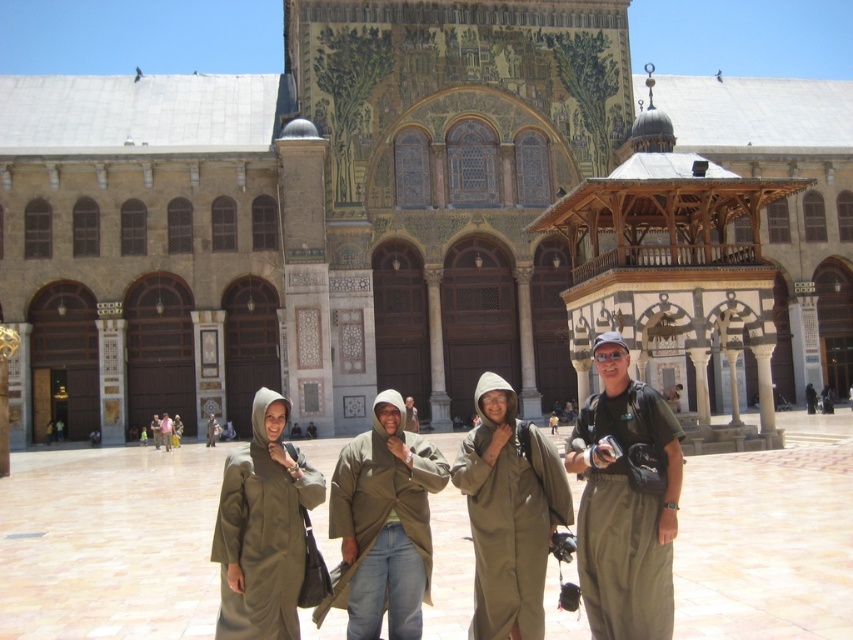
Question: Can you confirm if matte olive green jacket at center is positioned to the right of green fabric jacket at center?

Choices:
 (A) no
 (B) yes

Answer: (B)

Question: Which point is closer to the camera?

Choices:
 (A) (598, 477)
 (B) (387, 541)
 (C) (210, 445)
 (D) (845, 314)

Answer: (B)

Question: Which object is closer to the camera taking this photo?

Choices:
 (A) green fabric jacket at center
 (B) khaki fabric jacket at center
 (C) matte olive green jacket at center

Answer: (C)

Question: Estimate the real-world distances between objects in this image. Which object is farther from the olive-green fabric jacket at center?

Choices:
 (A) green fabric jacket at center
 (B) matte olive green jacket at center

Answer: (B)

Question: Is golden mosaic palace at center positioned in front of matte olive green jacket at center?

Choices:
 (A) yes
 (B) no

Answer: (B)

Question: Does olive-green fabric hooded robe at center appear on the right side of olive-green fabric coat at center?

Choices:
 (A) no
 (B) yes

Answer: (B)